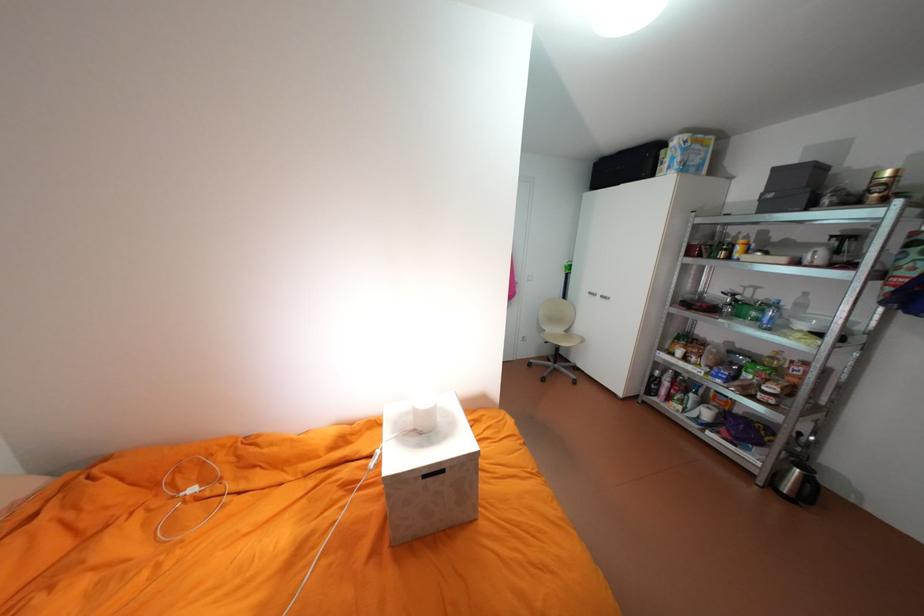
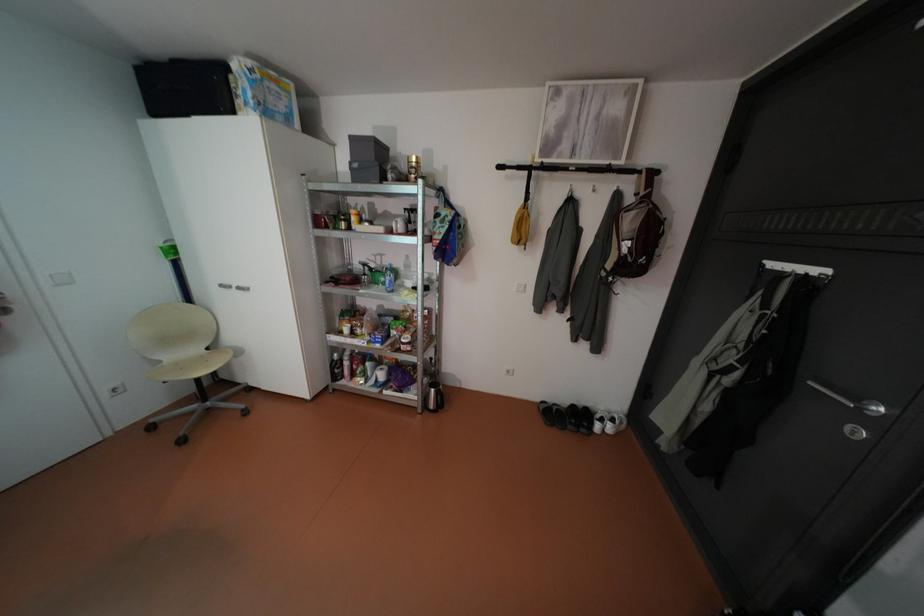
In the second image, find the point that corresponds to point 747,314 in the first image.

(383, 282)